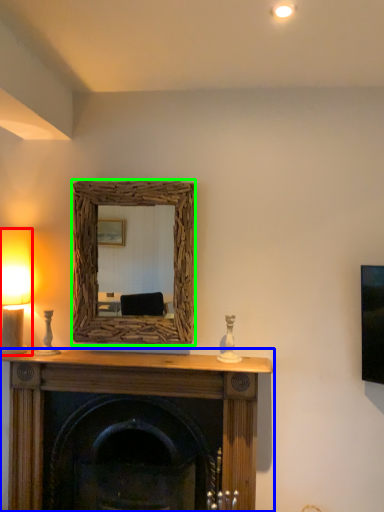
Question: Which object is the farthest from table lamp (highlighted by a red box)? Choose among these: fireplace (highlighted by a blue box) or picture frame (highlighted by a green box).

Choices:
 (A) fireplace
 (B) picture frame

Answer: (A)